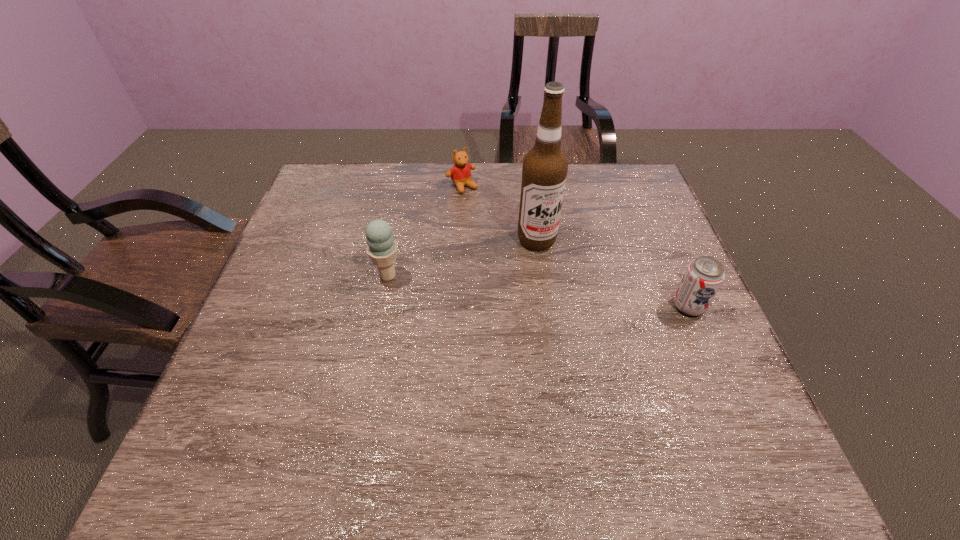
This screenshot has height=540, width=960. What are the coordinates of `free spot that satisfies the following two spatial constraints: 1. on the back side of the leftmost object; 2. on the right side of the third object from right to left` in the screenshot? It's located at (406, 187).

You are a GUI agent. You are given a task and a screenshot of the screen. Output one action in this format:
    pyautogui.click(x=<x>, y=<y>)
    Task: Click on the vacant space that satisfies the following two spatial constraints: 1. on the front side of the farthest object; 2. on the left side of the second object from right to left
    The width and height of the screenshot is (960, 540).
    Given the screenshot: What is the action you would take?
    pyautogui.click(x=460, y=240)